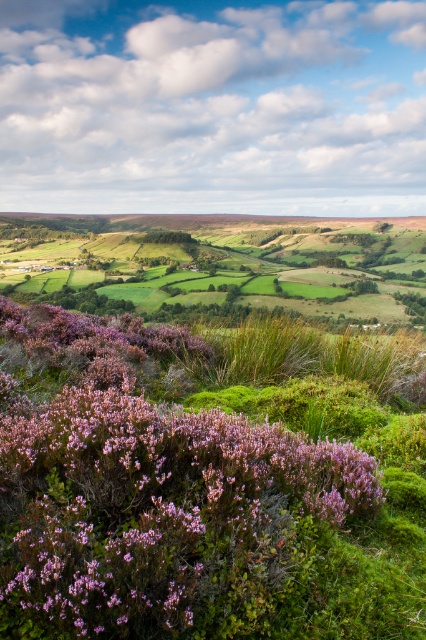
Question: Is purple matte flowers at lower left below green grassy field at center?

Choices:
 (A) yes
 (B) no

Answer: (A)

Question: Which point is closer to the camera taking this photo?

Choices:
 (A) pyautogui.click(x=270, y=218)
 (B) pyautogui.click(x=95, y=577)

Answer: (B)

Question: Which of the following is the closest to the observer?

Choices:
 (A) (342, 272)
 (B) (160, 330)

Answer: (B)

Question: Does purple matte flowers at lower left have a larger size compared to green grassy field at center?

Choices:
 (A) yes
 (B) no

Answer: (B)

Question: Observing the image, what is the correct spatial positioning of purple matte flowers at lower left in reference to green grassy field at center?

Choices:
 (A) below
 (B) above

Answer: (A)

Question: Which of the following is the closest to the observer?

Choices:
 (A) (135, 614)
 (B) (317, 268)

Answer: (A)